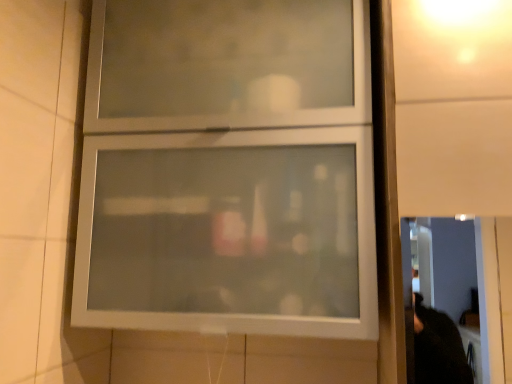
In order to face frosted glass cabinet at center, should I rotate leftwards or rightwards?

To face it directly, rotate left by 3.678 degrees.

Describe the element at coordinates (228, 193) in the screenshot. This screenshot has height=384, width=512. I see `frosted glass cabinet at center` at that location.

The image size is (512, 384). I want to click on frosted glass cabinet at center, so click(x=228, y=193).

Where is `frosted glass cabinet at center`? frosted glass cabinet at center is located at coordinates (228, 193).